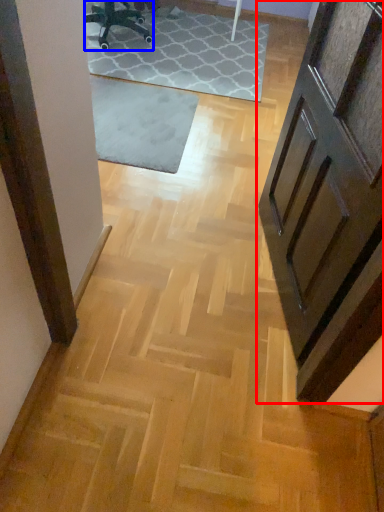
Question: Which of the following is the closest to the observer, door (highlighted by a red box) or chair (highlighted by a blue box)?

Choices:
 (A) door
 (B) chair

Answer: (A)